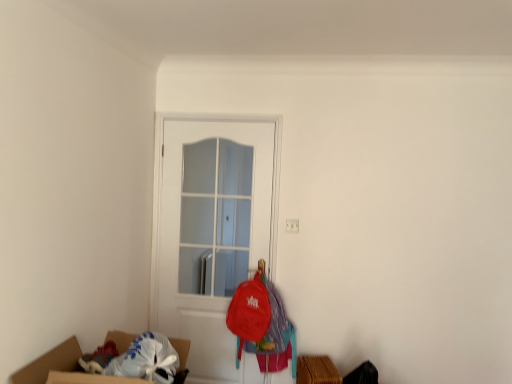
Question: Does white glossy door at center appear on the left side of matte red backpack at center?

Choices:
 (A) no
 (B) yes

Answer: (B)

Question: Can you confirm if white glossy door at center is taller than matte red backpack at center?

Choices:
 (A) no
 (B) yes

Answer: (B)

Question: Is white glossy door at center bigger than matte red backpack at center?

Choices:
 (A) yes
 (B) no

Answer: (A)

Question: Can we say white glossy door at center lies outside matte red backpack at center?

Choices:
 (A) no
 (B) yes

Answer: (B)

Question: Is white glossy door at center positioned with its back to matte red backpack at center?

Choices:
 (A) yes
 (B) no

Answer: (A)

Question: Is matte red backpack at center surrounded by white glossy door at center?

Choices:
 (A) yes
 (B) no

Answer: (B)

Question: Considering the relative sizes of matte red backpack at center and white glossy door at center in the image provided, is matte red backpack at center thinner than white glossy door at center?

Choices:
 (A) yes
 (B) no

Answer: (B)

Question: Considering the relative sizes of matte red backpack at center and white glossy door at center in the image provided, is matte red backpack at center wider than white glossy door at center?

Choices:
 (A) no
 (B) yes

Answer: (B)

Question: From a real-world perspective, is matte red backpack at center physically above white glossy door at center?

Choices:
 (A) no
 (B) yes

Answer: (A)

Question: Would you say matte red backpack at center is a long distance from white glossy door at center?

Choices:
 (A) yes
 (B) no

Answer: (B)

Question: Does matte red backpack at center have a greater height compared to white glossy door at center?

Choices:
 (A) yes
 (B) no

Answer: (B)

Question: Is matte red backpack at center looking in the opposite direction of white glossy door at center?

Choices:
 (A) yes
 (B) no

Answer: (A)

Question: From a real-world perspective, is matte red backpack at center positioned above or below white glossy door at center?

Choices:
 (A) below
 (B) above

Answer: (A)